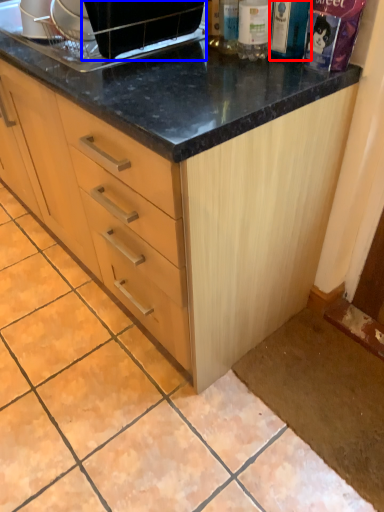
Question: Which object is further to the camera taking this photo, bottle (highlighted by a red box) or appliance (highlighted by a blue box)?

Choices:
 (A) bottle
 (B) appliance

Answer: (A)